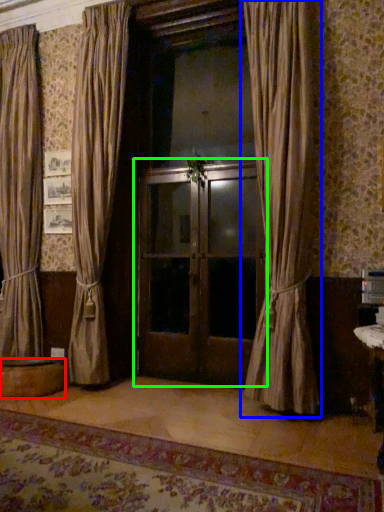
Question: Which is farther away from round table (highlighted by a red box)? curtain (highlighted by a blue box) or door (highlighted by a green box)?

Choices:
 (A) curtain
 (B) door

Answer: (A)